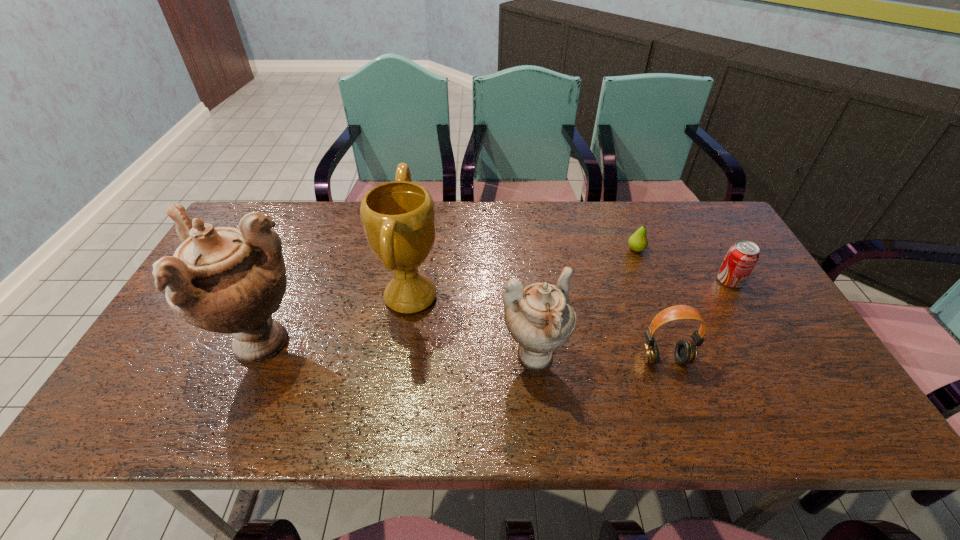
At what (x,y) coordinates should I click in order to perform the action: click on the leftmost object. Please return your answer as a coordinate pair (x, y). Looking at the image, I should click on coord(226,280).

Identify the location of the taller urn. This screenshot has width=960, height=540. (226, 280).

Locate an element on the screen. The height and width of the screenshot is (540, 960). the third tallest object is located at coordinates (540, 317).

At what (x,y) coordinates should I click in order to perform the action: click on the fourth object from right to left. Please return your answer as a coordinate pair (x, y). Looking at the image, I should click on (540, 317).

The image size is (960, 540). In order to click on the farthest object in this screenshot , I will do `click(638, 242)`.

Identify the location of pear. (638, 242).

Where is `the second shortest object`? The height and width of the screenshot is (540, 960). the second shortest object is located at coordinates (741, 258).

What are the coordinates of `the rightmost object` in the screenshot? It's located at (741, 258).

You are a GUI agent. You are given a task and a screenshot of the screen. Output one action in this format:
    pyautogui.click(x=<x>, y=<y>)
    Task: Click on the headset
    The height and width of the screenshot is (540, 960).
    Given the screenshot: What is the action you would take?
    pyautogui.click(x=685, y=351)

Image resolution: width=960 pixels, height=540 pixels. I want to click on the fifth object from right to left, so click(x=398, y=217).